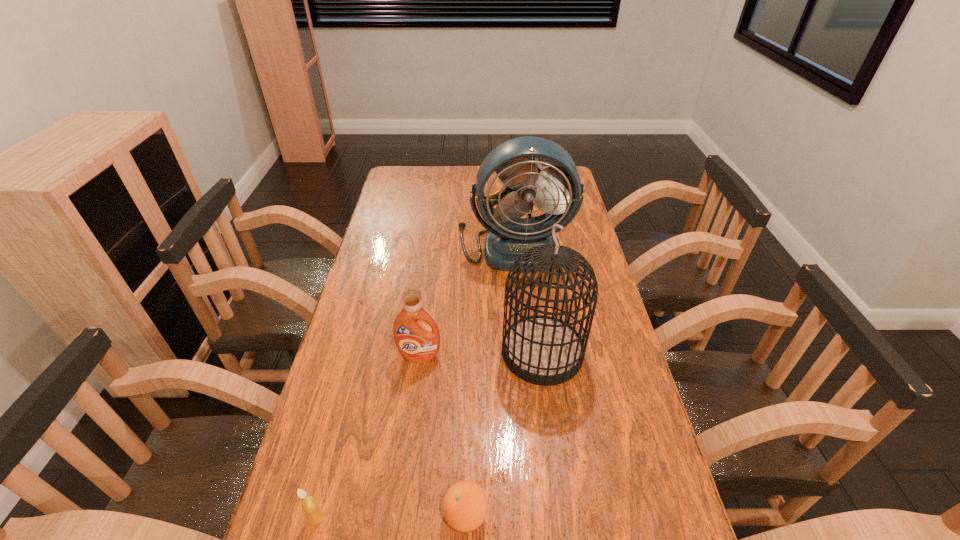
You are a GUI agent. You are given a task and a screenshot of the screen. Output one action in this format:
    pyautogui.click(x=<x>, y=<y>)
    Task: Click on the farthest object
    
    Given the screenshot: What is the action you would take?
    pyautogui.click(x=556, y=190)

This screenshot has height=540, width=960. Find the location of `birdcage`. birdcage is located at coordinates (543, 350).

Locate an element on the screen. The image size is (960, 540). detergent is located at coordinates (417, 342).

Locate an element on the screen. the second object from left to right is located at coordinates (417, 342).

Where is `the fourth tallest object`? This screenshot has width=960, height=540. the fourth tallest object is located at coordinates (310, 506).

You are a GUI agent. You are given a task and a screenshot of the screen. Output one action in this format:
    pyautogui.click(x=<x>, y=<y>)
    Task: Click on the leftmost object
    Image resolution: width=960 pixels, height=540 pixels.
    Given the screenshot: What is the action you would take?
    pyautogui.click(x=310, y=506)

Where is `the shortest object`? Image resolution: width=960 pixels, height=540 pixels. the shortest object is located at coordinates (465, 505).

You are a GUI agent. You are given a task and a screenshot of the screen. Output one action in this format:
    pyautogui.click(x=<x>, y=<y>)
    Task: Click on the free spot located 0.390m in front of the fan to blow air
    
    Given the screenshot: What is the action you would take?
    pyautogui.click(x=526, y=364)

What are the coordinates of `free spot located on the left of the birdcage` in the screenshot? It's located at (369, 352).

This screenshot has width=960, height=540. Identify the location of free space located on the front-facing side of the detergent. (401, 496).